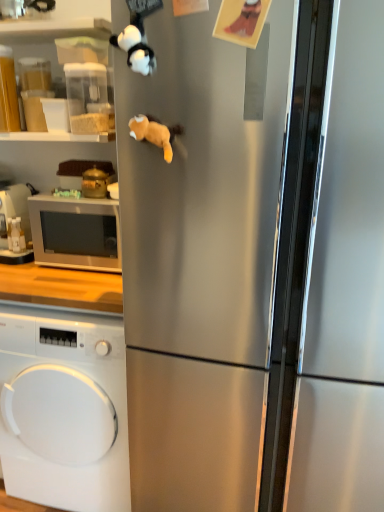
Question: From the image's perspective, relative to white plush panda at upper left, the first animal in the top-to-bottom sequence, is satin silver refrigerator at center above or below?

Choices:
 (A) above
 (B) below

Answer: (B)

Question: Relative to white plush panda at upper left, the first animal in the top-to-bottom sequence, is satin silver refrigerator at center in front or behind?

Choices:
 (A) behind
 (B) front

Answer: (B)

Question: Which object is positioned farthest from the orange plush toy at upper center, which is the 1th animal from bottom to top?

Choices:
 (A) white plush panda at upper left, arranged as the 2th animal when ordered from the bottom
 (B) white glossy microwave at left
 (C) white matte washing machine at lower left
 (D) matte black microwave at left, placed as the second appliance when sorted from front to back
 (E) gold metallic pot at left, the 1th appliance from the front

Answer: (C)

Question: Which is nearer to the satin silver refrigerator at center?

Choices:
 (A) orange plush toy at upper center, the 2th animal from the top
 (B) white matte washing machine at lower left
 (C) white plush panda at upper left, arranged as the 2th animal when ordered from the bottom
 (D) gold metallic pot at left, the 2th appliance in the back-to-front sequence
 (E) white glossy microwave at left

Answer: (A)